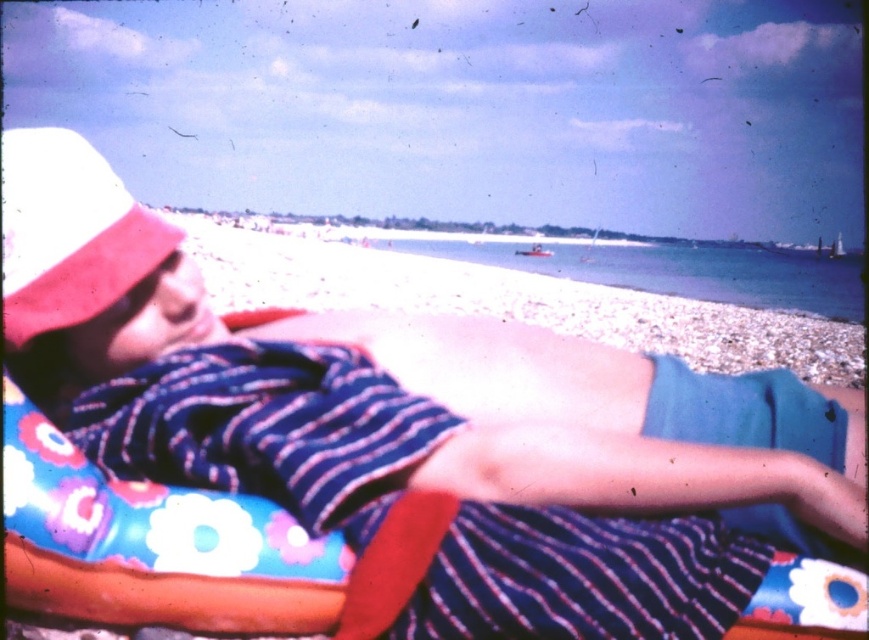
Who is positioned more to the left, white sand at center or pink fabric hat at upper left?

pink fabric hat at upper left is more to the left.

Is white sand at center shorter than pink fabric hat at upper left?

In fact, white sand at center may be taller than pink fabric hat at upper left.

Which is behind, point (685, 285) or point (90, 150)?

The point (685, 285) is more distant.

In order to click on white sand at center in this screenshot , I will do `click(522, 300)`.